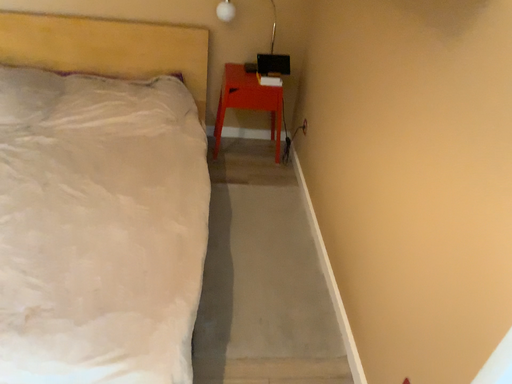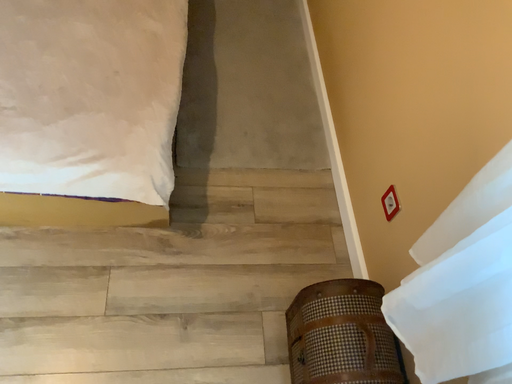
Question: Which way did the camera rotate in the video?

Choices:
 (A) rotated upward
 (B) rotated downward

Answer: (B)